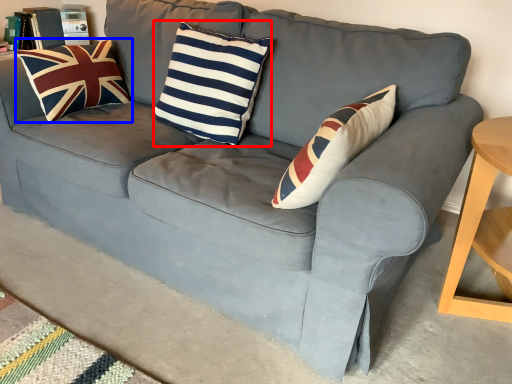
Question: Which object appears closest to the camera in this image, pillow (highlighted by a red box) or pillow (highlighted by a blue box)?

Choices:
 (A) pillow
 (B) pillow

Answer: (A)